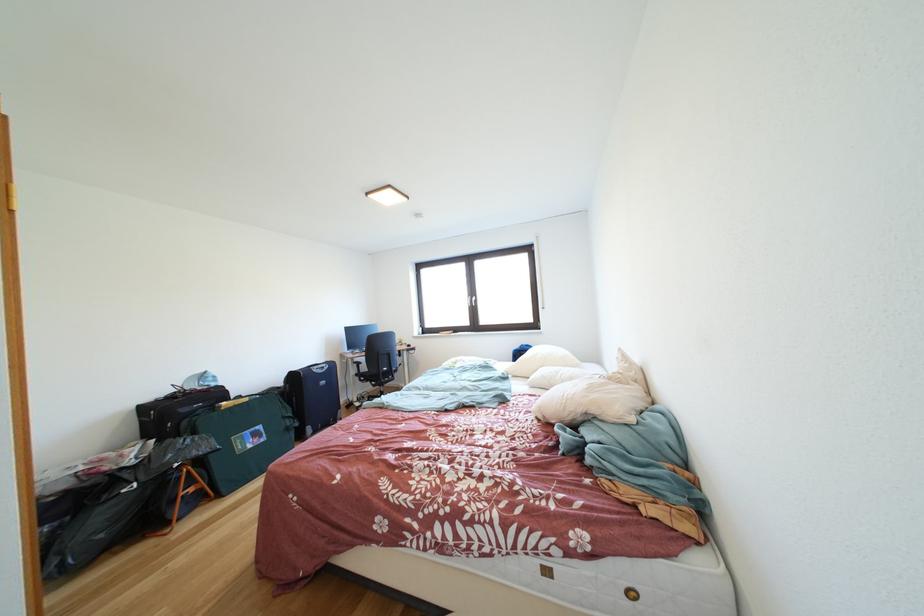
The width and height of the screenshot is (924, 616). What do you see at coordinates (176, 410) in the screenshot?
I see `the black suitcase handle` at bounding box center [176, 410].